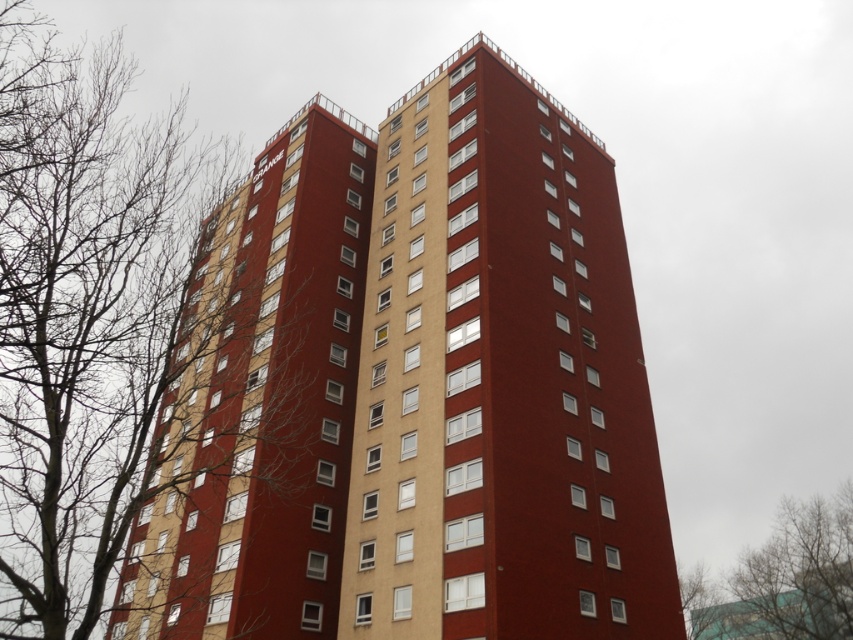
Does smooth brick building at center appear on the left side of bare branches at left?

In fact, smooth brick building at center is to the right of bare branches at left.

Between point (456, 556) and point (15, 68), which one is positioned behind?

The point (15, 68) is behind.

Describe the element at coordinates (500, 380) in the screenshot. This screenshot has width=853, height=640. I see `smooth brick building at center` at that location.

Locate an element on the screen. Image resolution: width=853 pixels, height=640 pixels. smooth brick building at center is located at coordinates (500, 380).

Does bare branches at left appear on the right side of bare branches at upper left?

In fact, bare branches at left is to the left of bare branches at upper left.

Which is above, bare branches at left or bare branches at upper left?

Positioned higher is bare branches at left.

Does point (19, 12) come in front of point (834, 499)?

That is True.

Locate an element on the screen. bare branches at left is located at coordinates (82, 314).

Is smooth brick building at center above bare branches at upper left?

Indeed, smooth brick building at center is positioned over bare branches at upper left.

Does point (521, 634) come farther from viewer compared to point (840, 628)?

No, it is not.

The image size is (853, 640). Identify the location of smooth brick building at center. (500, 380).